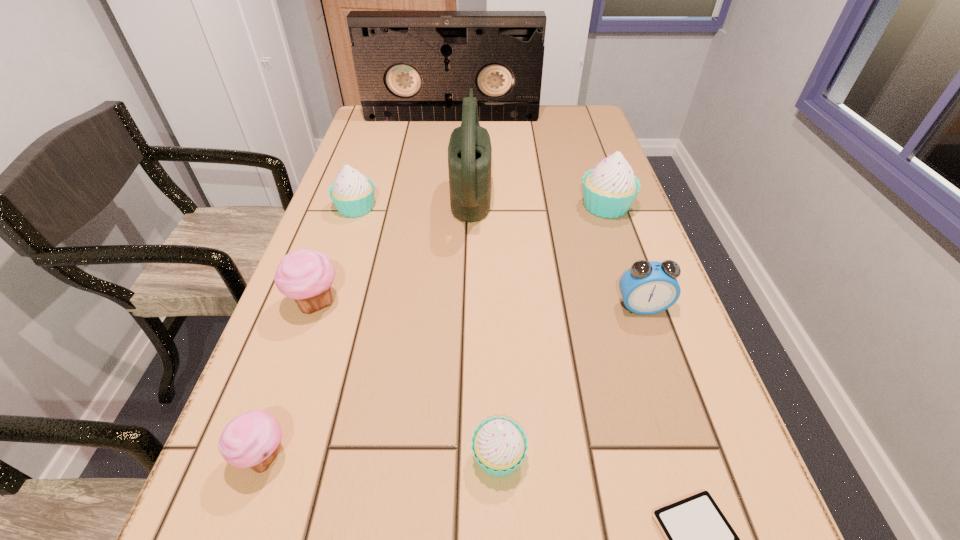
Locate an element on the screen. blank space located on the right of the smaller pink cupcake is located at coordinates (398, 456).

The image size is (960, 540). What are the coordinates of `object that is at the far edge` in the screenshot? It's located at (410, 65).

Locate an element on the screen. This screenshot has width=960, height=540. videotape positioned at the left edge is located at coordinates (410, 65).

This screenshot has height=540, width=960. In order to click on cupcake that is at the right edge in this screenshot , I will do 609,189.

The height and width of the screenshot is (540, 960). In order to click on alarm clock that is at the right edge in this screenshot , I will do `click(649, 287)`.

Identify the location of object situated at the far left corner. (410, 65).

The image size is (960, 540). In the image, there is a desktop. Find the location of `free space at the left edge`. free space at the left edge is located at coordinates (219, 476).

In the image, there is a desktop. Identify the location of vacant region at the right edge. This screenshot has height=540, width=960. (569, 155).

The height and width of the screenshot is (540, 960). In the image, there is a desktop. Identify the location of vacant space at the far left corner. (404, 132).

Where is `free space between the green watering can and the second cupcake from right to left`? The image size is (960, 540). free space between the green watering can and the second cupcake from right to left is located at coordinates (485, 323).